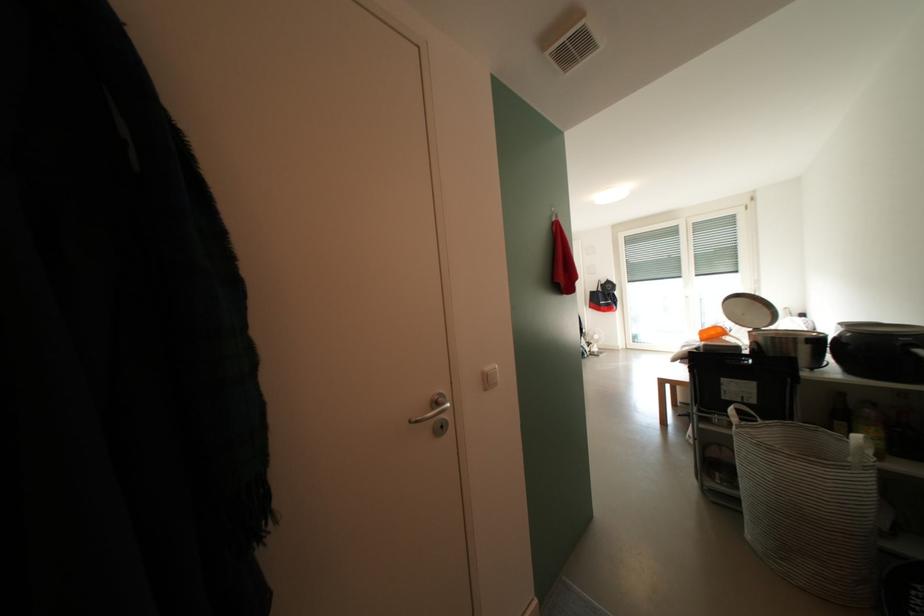
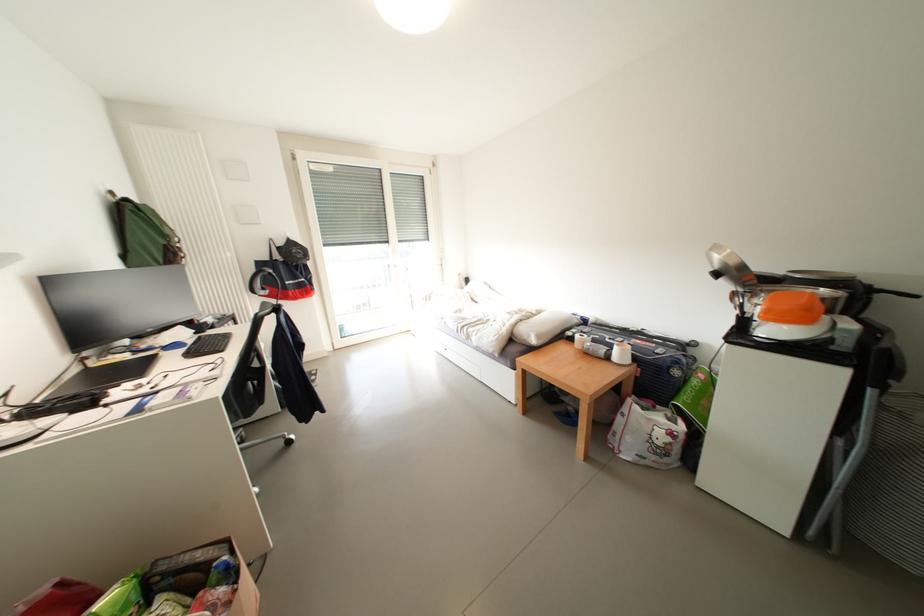
Find the pixel in the second image that matches (x=616, y=285) in the first image.

(298, 246)